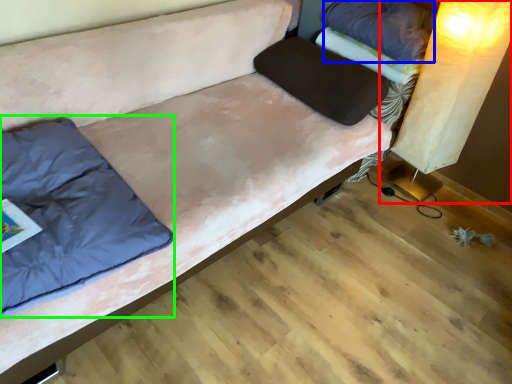
Question: Which object is positioned closest to table lamp (highlighted by a red box)? Select from pillow (highlighted by a blue box) and pillow (highlighted by a green box).

Choices:
 (A) pillow
 (B) pillow

Answer: (A)